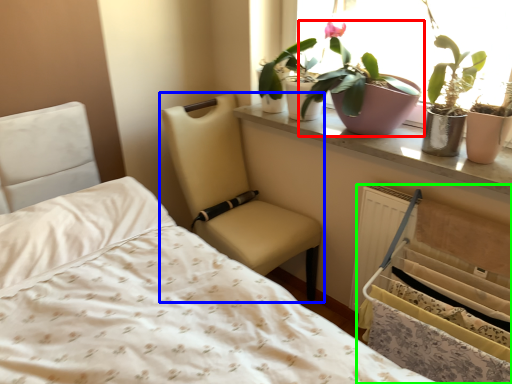
Question: Based on their relative distances, which object is farther from houseplant (highlighted by a red box)? Choose from chair (highlighted by a blue box) and bed frame (highlighted by a green box).

Choices:
 (A) chair
 (B) bed frame

Answer: (A)